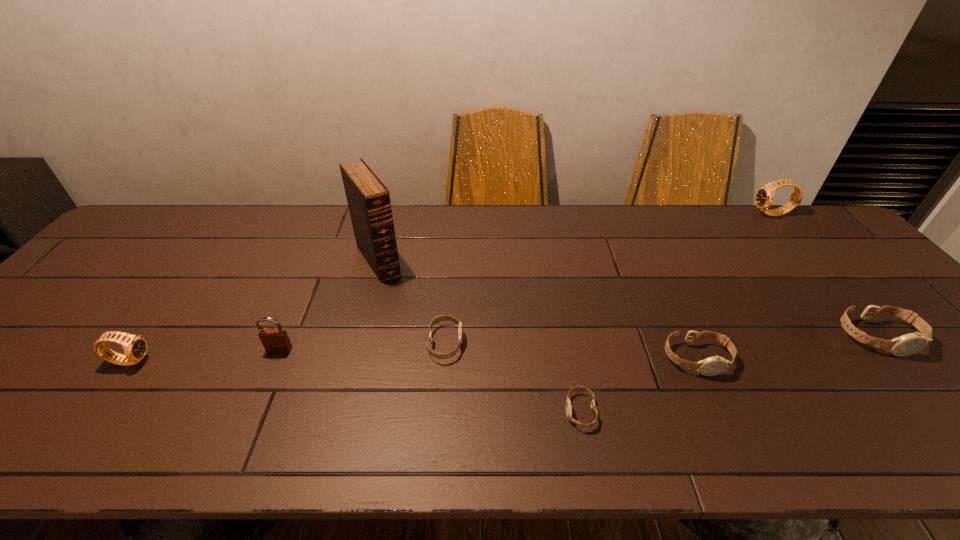
Identify the location of the tallest object. The height and width of the screenshot is (540, 960). (368, 199).

I want to click on the sixth object from right to left, so click(368, 199).

Locate an element on the screen. The height and width of the screenshot is (540, 960). the farther black watch is located at coordinates (764, 197).

In order to click on the right black watch in this screenshot , I will do `click(764, 197)`.

Find the location of a particular element. The width and height of the screenshot is (960, 540). the seventh object from right to left is located at coordinates (275, 340).

At what (x,y) coordinates should I click in order to perform the action: click on brown padlock. Please return your answer as a coordinate pair (x, y). The image size is (960, 540). Looking at the image, I should click on coord(275,340).

The height and width of the screenshot is (540, 960). In order to click on the smaller black watch in this screenshot , I will do `click(135, 347)`.

Where is `the leftmost object`? The width and height of the screenshot is (960, 540). the leftmost object is located at coordinates (135, 347).

This screenshot has width=960, height=540. I want to click on the fourth shortest object, so click(907, 344).

Locate an element on the screen. the third tallest watch is located at coordinates (907, 344).